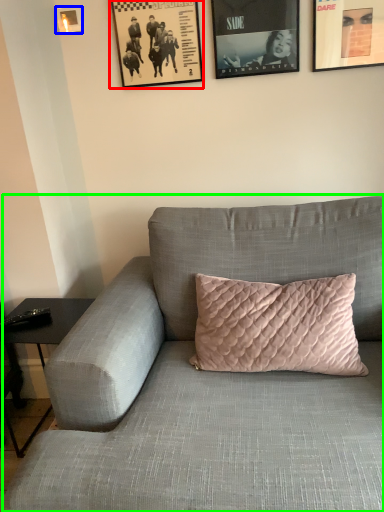
Question: Which object is the closest to the picture frame (highlighted by a red box)? Choose among these: picture frame (highlighted by a blue box) or studio couch (highlighted by a green box).

Choices:
 (A) picture frame
 (B) studio couch

Answer: (A)